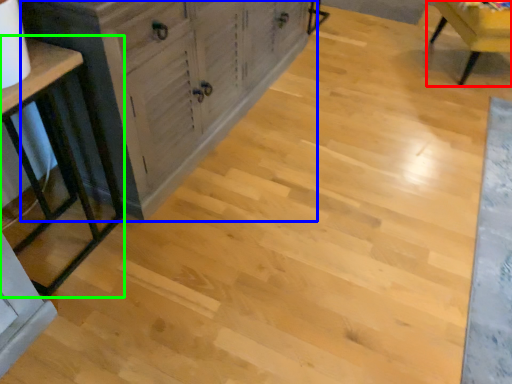
Question: Estimate the real-world distances between objects in this image. Which object is farther from chair (highlighted by a red box), cabinetry (highlighted by a blue box) or table (highlighted by a green box)?

Choices:
 (A) cabinetry
 (B) table

Answer: (B)